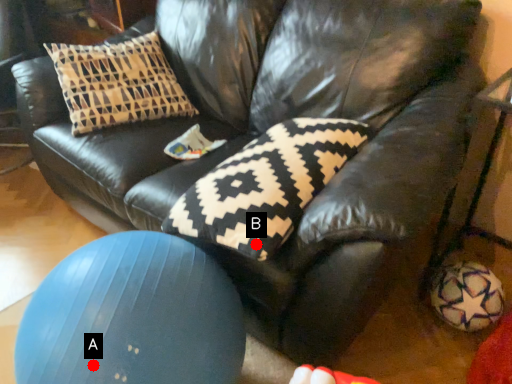
Question: Two points are circled on the image, labeled by A and B beside each circle. Which of the following is the closest to the observer?

Choices:
 (A) A is closer
 (B) B is closer

Answer: (A)